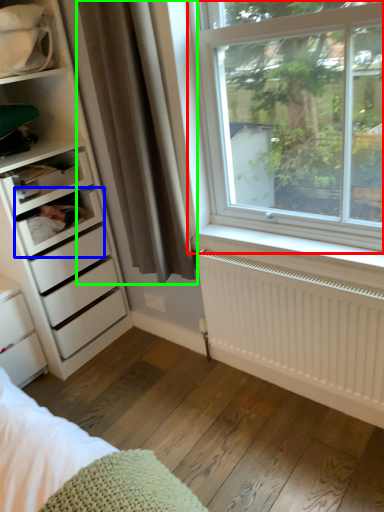
Question: Which object is positioned farthest from window (highlighted by a red box)? Select from shelf (highlighted by a blue box) and curtain (highlighted by a green box).

Choices:
 (A) shelf
 (B) curtain

Answer: (A)